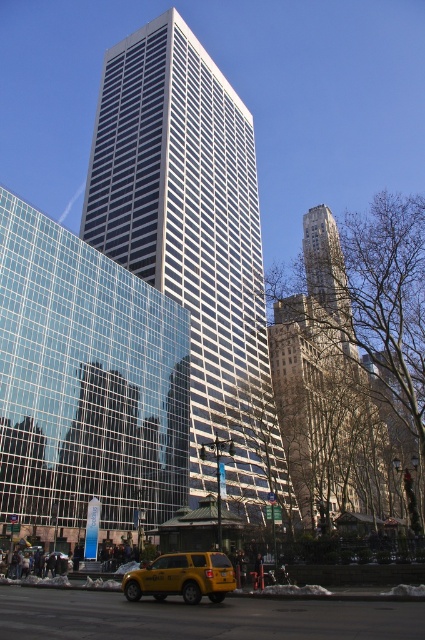
You are a city planner evaluating the urban layout. Considering the white glass building at center and the yellow matte taxi at center, which object occupies more space in the scene?

The white glass building at center is larger in size than the yellow matte taxi at center, so it occupies more space in the scene.

In the scene shown: You are a city planner analyzing the urban layout. Given the clear glass building at center and the yellow matte taxi at lower center, which object occupies more horizontal space in the image?

The clear glass building at center has a larger width than the yellow matte taxi at lower center, so it occupies more horizontal space.